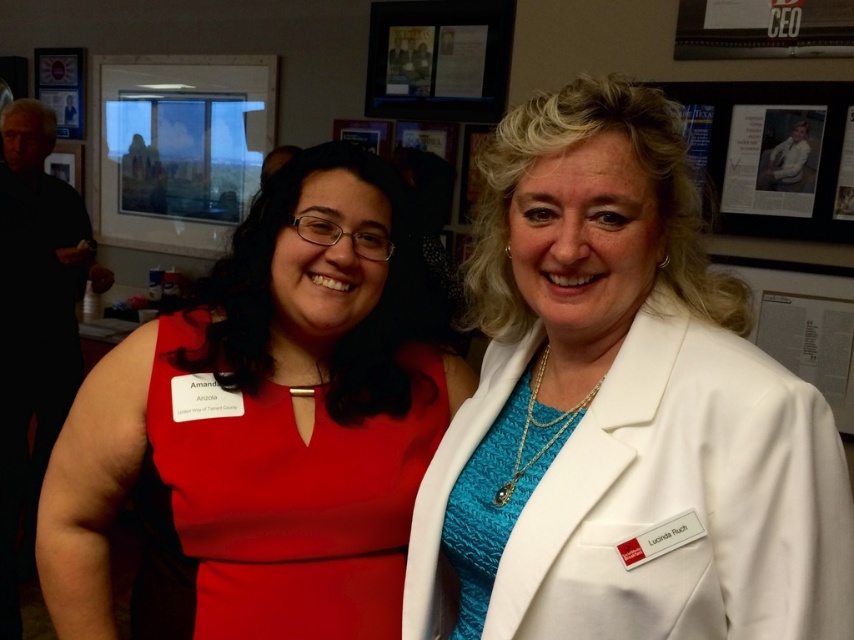
Question: Can you confirm if satin red dress at center is thinner than matte plastic picture frame at upper center?

Choices:
 (A) no
 (B) yes

Answer: (B)

Question: Which object appears closest to the camera in this image?

Choices:
 (A) white satin blazer at center
 (B) metallic poster at upper left
 (C) satin red dress at center
 (D) satin red dress at left

Answer: (A)

Question: Can you confirm if satin red dress at left is wider than metallic poster at upper left?

Choices:
 (A) yes
 (B) no

Answer: (A)

Question: Can you confirm if satin red dress at left is positioned above matte plastic picture frame at upper center?

Choices:
 (A) no
 (B) yes

Answer: (A)

Question: Estimate the real-world distances between objects in this image. Which object is closer to the matte plastic picture frame at upper center?

Choices:
 (A) satin red dress at left
 (B) white satin blazer at center

Answer: (A)

Question: Which is nearer to the satin red dress at center?

Choices:
 (A) metallic poster at upper left
 (B) satin red dress at left
 (C) matte plastic picture frame at upper center
 (D) white satin blazer at center

Answer: (B)